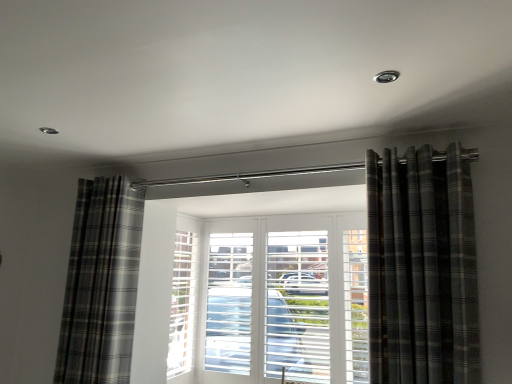
The width and height of the screenshot is (512, 384). I want to click on plaid fabric curtain at left, positioned as the second curtain in front-to-back order, so click(x=101, y=283).

This screenshot has height=384, width=512. Describe the element at coordinates (101, 283) in the screenshot. I see `plaid fabric curtain at left, which appears as the 1th curtain when viewed from the back` at that location.

Identify the location of plaid fabric curtain at right, which is counted as the 2th curtain, starting from the left. (422, 267).

The height and width of the screenshot is (384, 512). What do you see at coordinates (422, 267) in the screenshot?
I see `plaid fabric curtain at right, which is counted as the 2th curtain, starting from the left` at bounding box center [422, 267].

This screenshot has height=384, width=512. I want to click on plaid fabric curtain at left, the 2th curtain in the right-to-left sequence, so click(x=101, y=283).

Is plaid fabric curtain at left, which is counted as the first curtain, starting from the left, to the right of plaid fabric curtain at right, which appears as the first curtain when viewed from the right, from the viewer's perspective?

No, plaid fabric curtain at left, which is counted as the first curtain, starting from the left, is not to the right of plaid fabric curtain at right, which appears as the first curtain when viewed from the right.

Which object is closer to the camera, plaid fabric curtain at left, the 2th curtain in the right-to-left sequence, or plaid fabric curtain at right, which appears as the 2th curtain when viewed from the back?

Positioned in front is plaid fabric curtain at right, which appears as the 2th curtain when viewed from the back.

Is point (115, 183) closer to viewer compared to point (438, 237)?

No.

From the image's perspective, does plaid fabric curtain at left, which is counted as the first curtain, starting from the left, appear lower than plaid fabric curtain at right, which appears as the 1th curtain when viewed from the front?

Correct, plaid fabric curtain at left, which is counted as the first curtain, starting from the left, appears lower than plaid fabric curtain at right, which appears as the 1th curtain when viewed from the front, in the image.

From a real-world perspective, is plaid fabric curtain at left, which is counted as the first curtain, starting from the left, above or below plaid fabric curtain at right, which appears as the 2th curtain when viewed from the back?

plaid fabric curtain at left, which is counted as the first curtain, starting from the left, is below plaid fabric curtain at right, which appears as the 2th curtain when viewed from the back.

In the scene shown: Can you confirm if plaid fabric curtain at left, positioned as the second curtain in front-to-back order, is wider than plaid fabric curtain at right, which appears as the first curtain when viewed from the right?

Yes.

Who is shorter, plaid fabric curtain at left, positioned as the second curtain in front-to-back order, or plaid fabric curtain at right, which is counted as the 2th curtain, starting from the left?

Standing shorter between the two is plaid fabric curtain at right, which is counted as the 2th curtain, starting from the left.

Considering the sizes of plaid fabric curtain at left, which is counted as the first curtain, starting from the left, and plaid fabric curtain at right, which appears as the first curtain when viewed from the right, in the image, is plaid fabric curtain at left, which is counted as the first curtain, starting from the left, bigger or smaller than plaid fabric curtain at right, which appears as the first curtain when viewed from the right,?

Considering their sizes, plaid fabric curtain at left, which is counted as the first curtain, starting from the left, takes up more space than plaid fabric curtain at right, which appears as the first curtain when viewed from the right.

Would you say plaid fabric curtain at left, positioned as the second curtain in front-to-back order, contains plaid fabric curtain at right, which appears as the 1th curtain when viewed from the front?

No, plaid fabric curtain at right, which appears as the 1th curtain when viewed from the front, is not a part of plaid fabric curtain at left, positioned as the second curtain in front-to-back order.

Is the surface of plaid fabric curtain at left, which appears as the 1th curtain when viewed from the back, in direct contact with plaid fabric curtain at right, which appears as the 2th curtain when viewed from the back?

There is a gap between plaid fabric curtain at left, which appears as the 1th curtain when viewed from the back, and plaid fabric curtain at right, which appears as the 2th curtain when viewed from the back.

Is plaid fabric curtain at left, positioned as the second curtain in front-to-back order, turned away from plaid fabric curtain at right, which appears as the 2th curtain when viewed from the back?

plaid fabric curtain at left, positioned as the second curtain in front-to-back order, does not have its back to plaid fabric curtain at right, which appears as the 2th curtain when viewed from the back.

Locate an element on the screen. The width and height of the screenshot is (512, 384). curtain that is behind the plaid fabric curtain at right, which appears as the first curtain when viewed from the right is located at coordinates (101, 283).

In the scene shown: Can you confirm if plaid fabric curtain at right, which is counted as the 2th curtain, starting from the left, is positioned to the left of plaid fabric curtain at left, which is counted as the first curtain, starting from the left?

No.

Is plaid fabric curtain at right, which appears as the first curtain when viewed from the right, in front of or behind plaid fabric curtain at left, positioned as the second curtain in front-to-back order, in the image?

In the image, plaid fabric curtain at right, which appears as the first curtain when viewed from the right, appears in front of plaid fabric curtain at left, positioned as the second curtain in front-to-back order.

Considering the positions of point (454, 341) and point (114, 297), is point (454, 341) closer or farther from the camera than point (114, 297)?

Point (454, 341) is closer to the camera than point (114, 297).

From the image's perspective, which is below, plaid fabric curtain at right, which appears as the 2th curtain when viewed from the back, or plaid fabric curtain at left, positioned as the second curtain in front-to-back order?

From the image's view, plaid fabric curtain at left, positioned as the second curtain in front-to-back order, is below.

From a real-world perspective, which object rests below the other?

In real-world perspective, plaid fabric curtain at left, which appears as the 1th curtain when viewed from the back, is lower.

Considering the sizes of objects plaid fabric curtain at right, which appears as the 2th curtain when viewed from the back, and plaid fabric curtain at left, which appears as the 1th curtain when viewed from the back, in the image provided, who is thinner, plaid fabric curtain at right, which appears as the 2th curtain when viewed from the back, or plaid fabric curtain at left, which appears as the 1th curtain when viewed from the back,?

plaid fabric curtain at right, which appears as the 2th curtain when viewed from the back.

Who is shorter, plaid fabric curtain at right, which appears as the 2th curtain when viewed from the back, or plaid fabric curtain at left, positioned as the second curtain in front-to-back order?

plaid fabric curtain at right, which appears as the 2th curtain when viewed from the back.

Consider the image. Based on their sizes in the image, would you say plaid fabric curtain at right, which appears as the first curtain when viewed from the right, is bigger or smaller than plaid fabric curtain at left, the 2th curtain in the right-to-left sequence?

plaid fabric curtain at right, which appears as the first curtain when viewed from the right, is smaller than plaid fabric curtain at left, the 2th curtain in the right-to-left sequence.

Is plaid fabric curtain at right, which is counted as the 2th curtain, starting from the left, positioned beyond the bounds of plaid fabric curtain at left, the 2th curtain in the right-to-left sequence?

Yes.

Is plaid fabric curtain at right, which appears as the 1th curtain when viewed from the front, positioned far away from plaid fabric curtain at left, which appears as the 1th curtain when viewed from the back?

plaid fabric curtain at right, which appears as the 1th curtain when viewed from the front, is far away from plaid fabric curtain at left, which appears as the 1th curtain when viewed from the back.

Is plaid fabric curtain at right, which is counted as the 2th curtain, starting from the left, aimed at plaid fabric curtain at left, the 2th curtain in the right-to-left sequence?

No, plaid fabric curtain at right, which is counted as the 2th curtain, starting from the left, is not oriented towards plaid fabric curtain at left, the 2th curtain in the right-to-left sequence.

What are the coordinates of `curtain below the plaid fabric curtain at right, which is counted as the 2th curtain, starting from the left (from the image's perspective)` in the screenshot? It's located at (101, 283).

Find the location of a particular element. The width and height of the screenshot is (512, 384). curtain located below the plaid fabric curtain at right, which is counted as the 2th curtain, starting from the left (from the image's perspective) is located at coordinates (101, 283).

You are a GUI agent. You are given a task and a screenshot of the screen. Output one action in this format:
    pyautogui.click(x=<x>, y=<y>)
    Task: Click on the curtain in front of the plaid fabric curtain at left, the 2th curtain in the right-to-left sequence
    
    Given the screenshot: What is the action you would take?
    pyautogui.click(x=422, y=267)